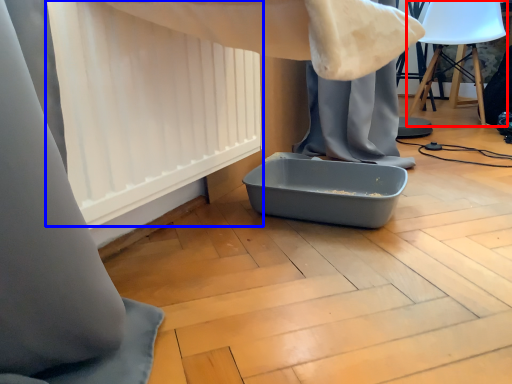
Question: Among these objects, which one is farthest to the camera, swivel chair (highlighted by a red box) or curtain (highlighted by a blue box)?

Choices:
 (A) swivel chair
 (B) curtain

Answer: (A)